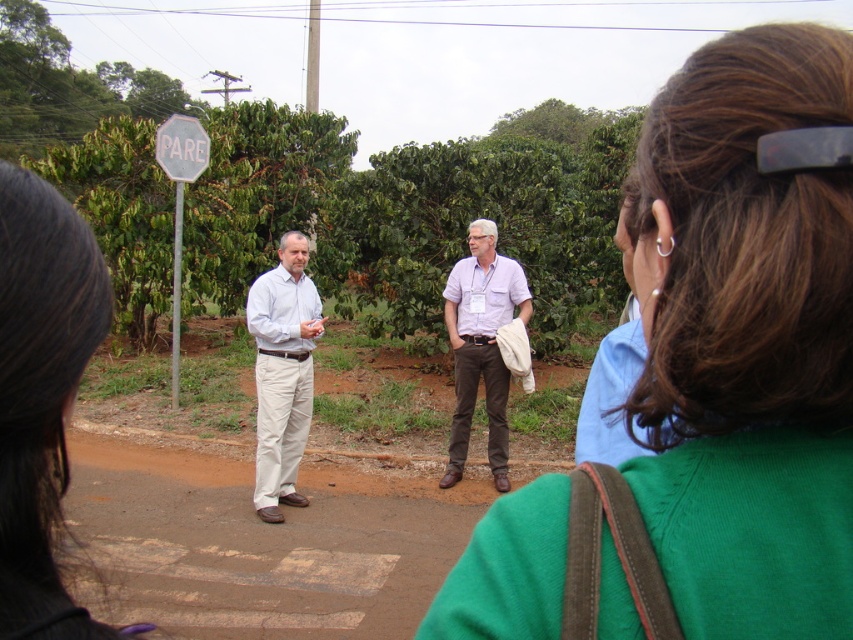
You are standing at the point labeled point [712,273] and want to walk to the point labeled point [277,509]. Which direction should you move in relation to the camera?

You should move downward and to the right relative to the camera to reach point [277,509] from point [712,273].

You are a photographer trying to capture a photo of the green fabric at center and the black hair at upper left. Based on their sizes in the image, which object do you think is closer to the camera?

The green fabric at center might be wider than black hair at upper left, so it is likely closer to the camera since wider objects appear closer in photos.